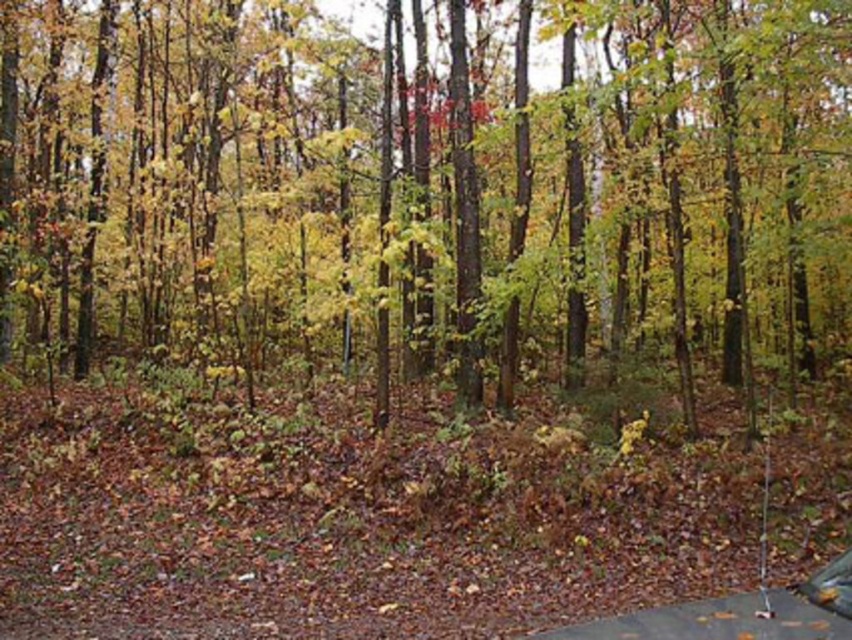
Question: Can you confirm if yellow-green leaves at center is positioned below metallic silver car at lower right?

Choices:
 (A) yes
 (B) no

Answer: (B)

Question: Does yellow-green leaves at center have a lesser width compared to metallic silver car at lower right?

Choices:
 (A) no
 (B) yes

Answer: (A)

Question: Is the position of yellow-green leaves at center more distant than that of metallic silver car at lower right?

Choices:
 (A) yes
 (B) no

Answer: (A)

Question: Which of the following is the farthest from the observer?

Choices:
 (A) yellow-green leaves at center
 (B) metallic silver car at lower right

Answer: (A)

Question: Which point is farther from the camera taking this photo?

Choices:
 (A) (843, 554)
 (B) (280, 317)

Answer: (B)